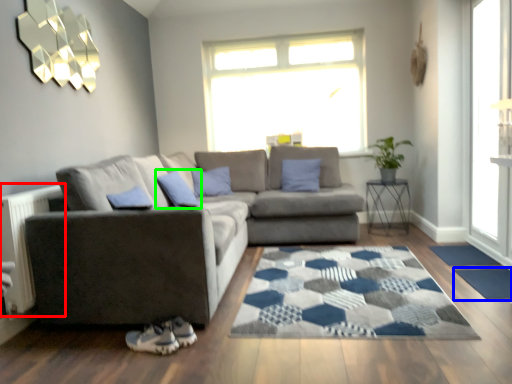
Question: Which object is positioned closest to radiator (highlighted by a red box)? Select from doormat (highlighted by a blue box) and pillow (highlighted by a green box).

Choices:
 (A) doormat
 (B) pillow

Answer: (B)